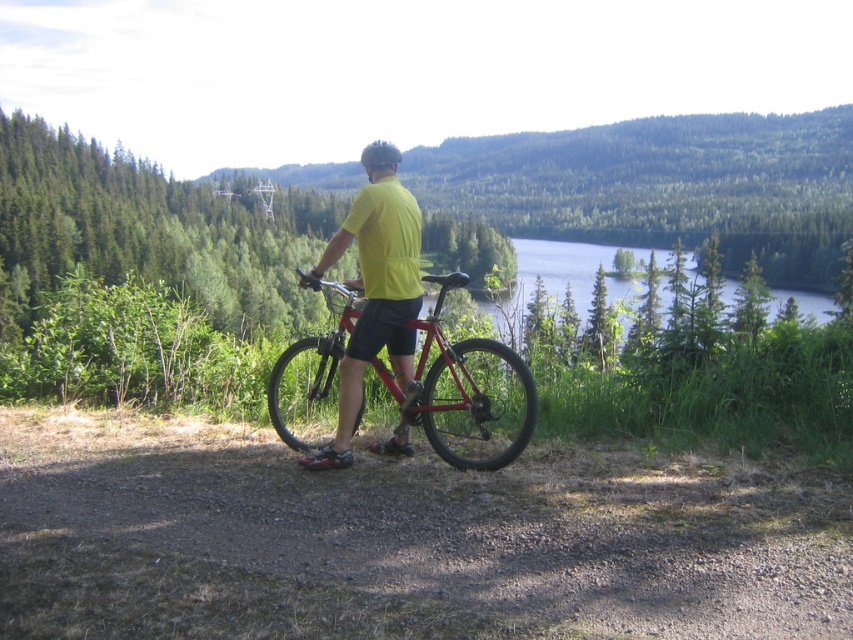
You are a delivery drone operator. Your drone has a maximum payload capacity of 3.5 meters in length. You need to deliver the shiny metallic bicycle at center and yellow matte shirt at center together. Can the drone carry both items side by side without exceeding its length capacity?

The distance between the shiny metallic bicycle at center and yellow matte shirt at center is 3.26 meters, so the drone can carry both items side by side since their combined length is within the 3.5 meters limit.

You are a photographer trying to capture the best shot of the scene. You need to determine which of the two points, point (73, 440) or point (422, 428), is closer to the camera to frame your shot. Which point is closer?

Point (422, 428) is closer to the camera than point (73, 440) because the Objects Description states that point (73, 440) is further away.